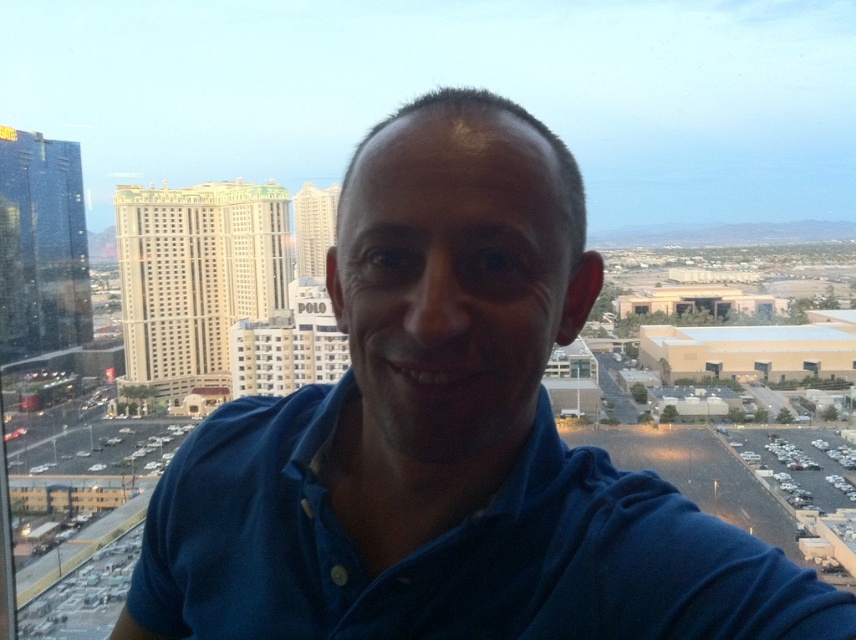
Can you confirm if blue cotton shirt at center is positioned to the right of blue cotton polo shirt at center?

No, blue cotton shirt at center is not to the right of blue cotton polo shirt at center.

Between point (446, 496) and point (492, 540), which one is positioned in front?

Point (492, 540) is more forward.

Does point (512, 300) lie behind point (300, 502)?

Yes, it is behind point (300, 502).

This screenshot has height=640, width=856. In order to click on blue cotton shirt at center in this screenshot , I will do `click(449, 440)`.